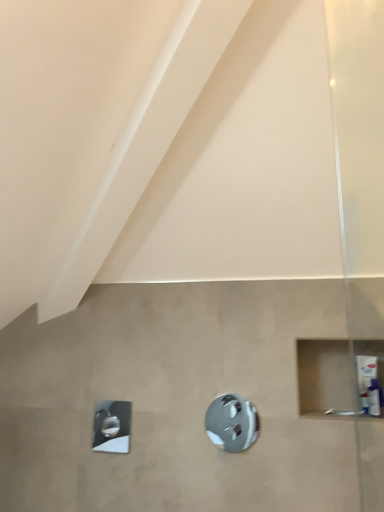
Question: From a real-world perspective, is white plastic tube at right positioned above or below polished chrome showerhead at lower left, the 2th shower from the front?

Choices:
 (A) above
 (B) below

Answer: (A)

Question: Is white plastic tube at right in front of or behind polished chrome showerhead at lower left, the first shower positioned from the left, in the image?

Choices:
 (A) front
 (B) behind

Answer: (A)

Question: Based on their relative distances, which object is nearer to the polished chrome shower at center, which is counted as the second shower, starting from the left?

Choices:
 (A) polished chrome showerhead at lower left, the 2th shower from the front
 (B) white plastic tube at right

Answer: (A)

Question: Estimate the real-world distances between objects in this image. Which object is farther from the white plastic tube at right?

Choices:
 (A) polished chrome showerhead at lower left, the first shower positioned from the left
 (B) polished chrome shower at center, placed as the 1th shower when sorted from front to back

Answer: (A)